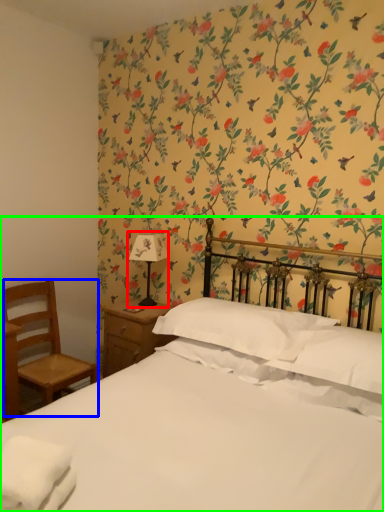
Question: Considering the real-world distances, which object is closest to bedside lamp (highlighted by a red box)? chair (highlighted by a blue box) or bed (highlighted by a green box).

Choices:
 (A) chair
 (B) bed

Answer: (A)